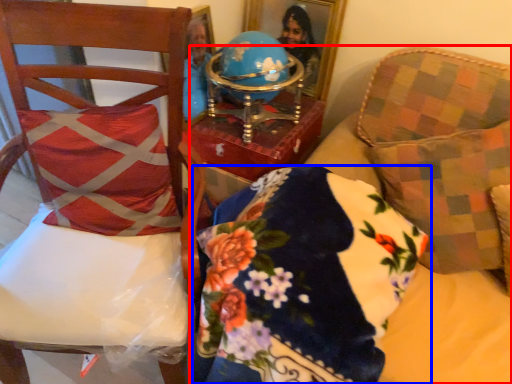
Question: Which object is closer to the camera taking this photo, furniture (highlighted by a red box) or pillow (highlighted by a blue box)?

Choices:
 (A) furniture
 (B) pillow

Answer: (A)